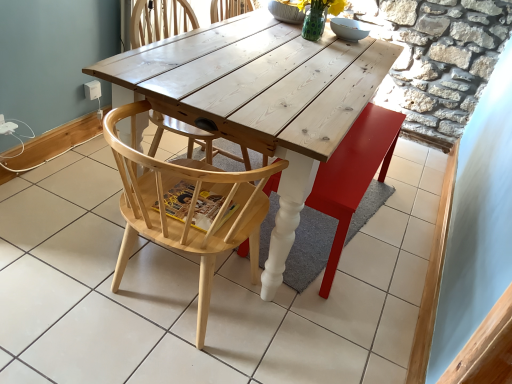
Where is `free spot in front of wooden swivel chair at center`? free spot in front of wooden swivel chair at center is located at coordinates (345, 306).